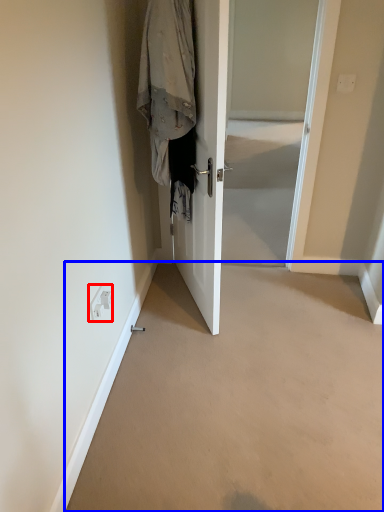
Question: Among these objects, which one is farthest to the camera, electric outlet (highlighted by a red box) or corridor (highlighted by a blue box)?

Choices:
 (A) electric outlet
 (B) corridor

Answer: (A)